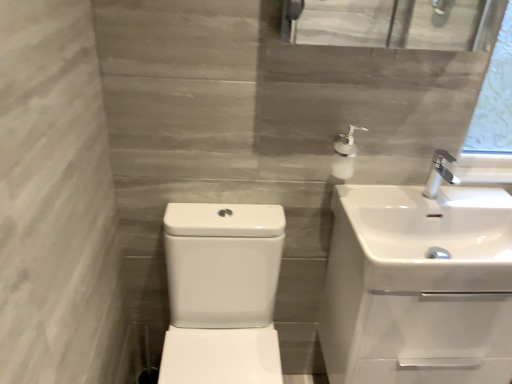
Question: Is white glossy soap dispenser at upper right situated inside white glossy sink at upper right, which ranks as the 3th sink in left-to-right order, or outside?

Choices:
 (A) inside
 (B) outside

Answer: (B)

Question: In terms of height, does white glossy soap dispenser at upper right look taller or shorter compared to white glossy sink at upper right, which ranks as the 3th sink in left-to-right order?

Choices:
 (A) tall
 (B) short

Answer: (B)

Question: Estimate the real-world distances between objects in this image. Which object is closer to the white glossy sink at right, which is counted as the second sink, starting from the left?

Choices:
 (A) white glossy soap dispenser at upper right
 (B) white glossy sink at upper right, which is the 1th sink in right-to-left order
 (C) white glossy sink at center, which is the third sink from right to left

Answer: (B)

Question: Which of these objects is positioned closest to the white glossy soap dispenser at upper right?

Choices:
 (A) white glossy sink at right, the second sink positioned from the right
 (B) white glossy sink at center, which is the third sink from right to left
 (C) white glossy sink at upper right, which is the 1th sink in right-to-left order

Answer: (C)